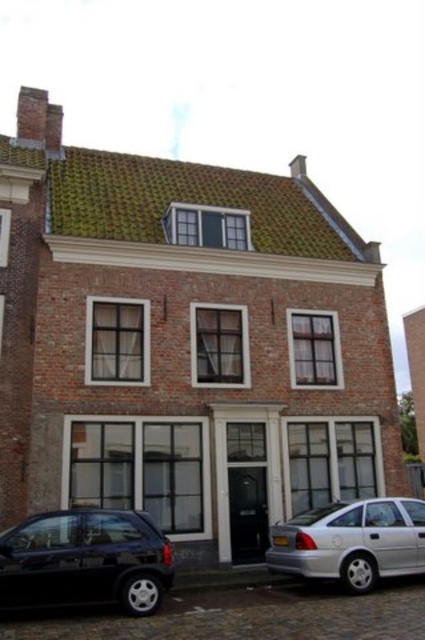
Question: Does shiny black car at lower left have a greater width compared to silver metallic sedan at lower right?

Choices:
 (A) no
 (B) yes

Answer: (A)

Question: Which object is closer to the camera taking this photo?

Choices:
 (A) shiny black car at lower left
 (B) silver metallic sedan at lower right

Answer: (A)

Question: Where is shiny black car at lower left located in relation to silver metallic sedan at lower right in the image?

Choices:
 (A) right
 (B) left

Answer: (B)

Question: Which point is farther to the camera?

Choices:
 (A) (387, 541)
 (B) (146, 577)

Answer: (A)

Question: Is shiny black car at lower left positioned at the back of silver metallic sedan at lower right?

Choices:
 (A) yes
 (B) no

Answer: (B)

Question: Which point is farther to the camera?

Choices:
 (A) shiny black car at lower left
 (B) silver metallic sedan at lower right

Answer: (B)